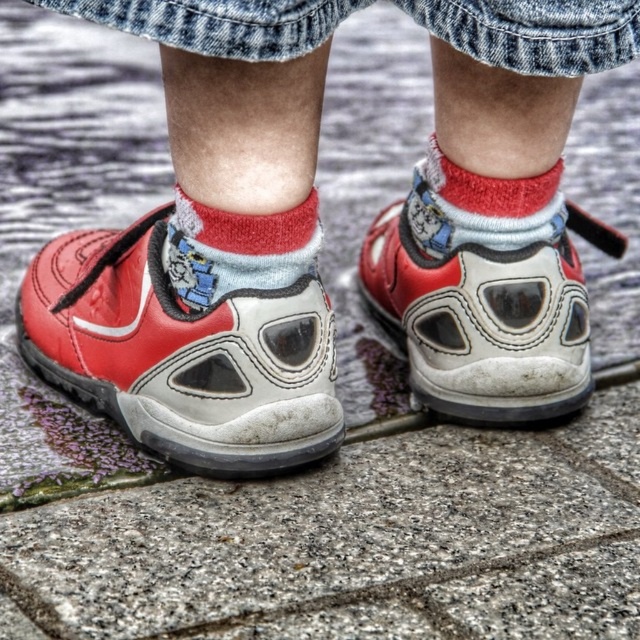
Question: Which object appears farthest from the camera in this image?

Choices:
 (A) white leather shoe at center
 (B) knitted wool sock at center

Answer: (A)

Question: Considering the real-world distances, which object is closest to the matte leather shoes at center?

Choices:
 (A) white leather shoe at center
 (B) red cotton sock at center
 (C) knitted wool sock at center
 (D) matte leather shoe at center

Answer: (D)

Question: Is matte leather shoe at center to the left of knitted wool sock at center from the viewer's perspective?

Choices:
 (A) no
 (B) yes

Answer: (B)

Question: Which of the following is the farthest from the observer?

Choices:
 (A) (432, 323)
 (B) (499, 1)
 (C) (557, 234)
 (D) (301, 268)

Answer: (A)

Question: Is knitted wool sock at center to the right of red cotton sock at center from the viewer's perspective?

Choices:
 (A) no
 (B) yes

Answer: (A)

Question: Is matte leather shoes at center to the right of white leather shoe at center from the viewer's perspective?

Choices:
 (A) yes
 (B) no

Answer: (B)